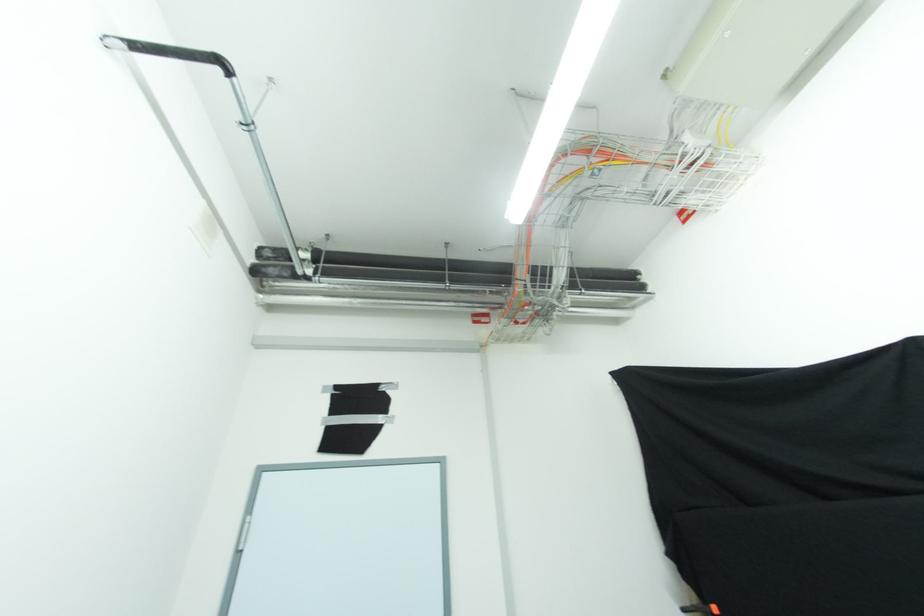
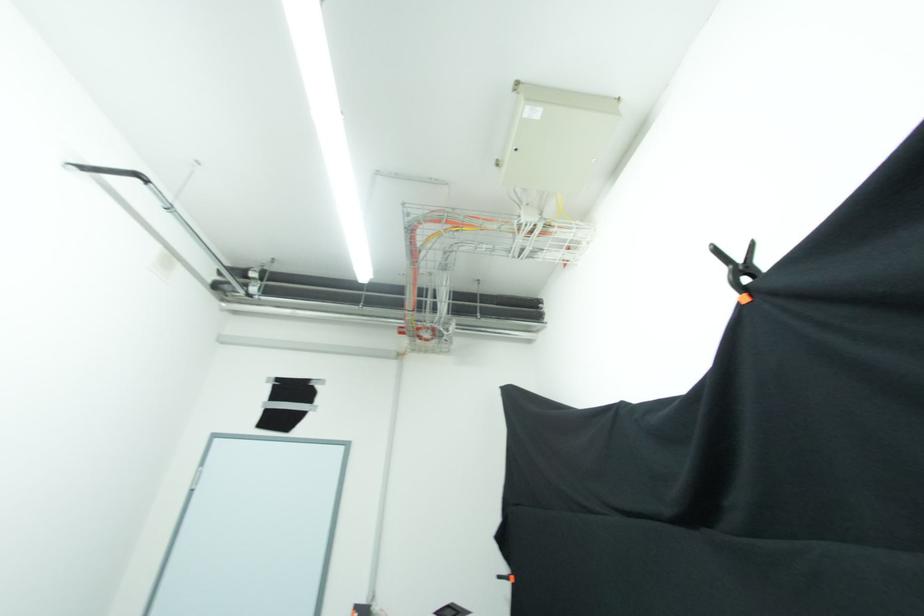
In a continuous first-person perspective shot, in which direction is the camera moving?

The cameraman moved toward right, backward.